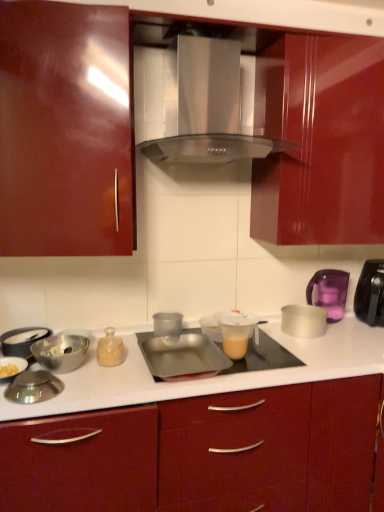
The width and height of the screenshot is (384, 512). What are the coordinates of `free space above satin silver range hood at center (from a real-world perspective)` in the screenshot? It's located at pyautogui.click(x=209, y=24).